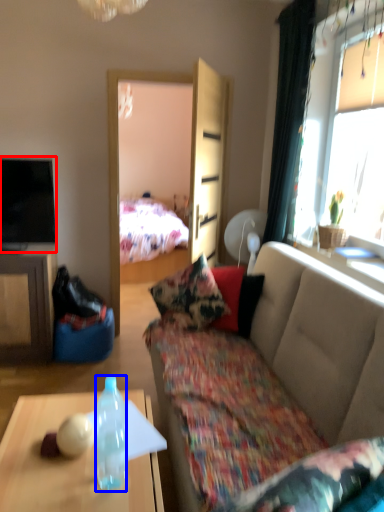
Question: Which of the following is the closest to the observer, television (highlighted by a red box) or bottle (highlighted by a blue box)?

Choices:
 (A) television
 (B) bottle

Answer: (B)